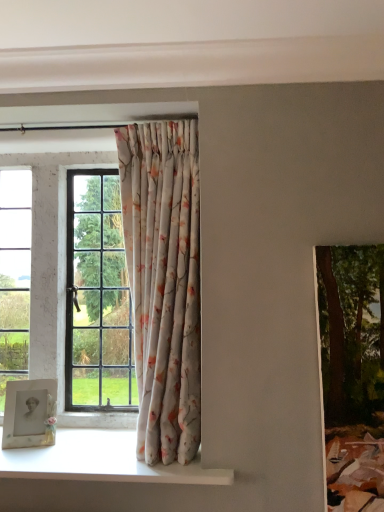
Question: Would you consider matte white picture frame at lower left to be distant from white glossy window sill at lower left?

Choices:
 (A) yes
 (B) no

Answer: (B)

Question: From the image's perspective, does matte white picture frame at lower left appear lower than white glossy window sill at lower left?

Choices:
 (A) no
 (B) yes

Answer: (A)

Question: Considering the relative positions of matte white picture frame at lower left and white glossy window sill at lower left in the image provided, is matte white picture frame at lower left to the left of white glossy window sill at lower left from the viewer's perspective?

Choices:
 (A) no
 (B) yes

Answer: (B)

Question: Can you confirm if matte white picture frame at lower left is shorter than white glossy window sill at lower left?

Choices:
 (A) yes
 (B) no

Answer: (B)

Question: Does matte white picture frame at lower left appear on the right side of white glossy window sill at lower left?

Choices:
 (A) no
 (B) yes

Answer: (A)

Question: Is green textured painting at right wider or thinner than floral fabric curtain at center?

Choices:
 (A) thin
 (B) wide

Answer: (A)

Question: From the image's perspective, is green textured painting at right located above or below floral fabric curtain at center?

Choices:
 (A) above
 (B) below

Answer: (B)

Question: Does point (337, 402) appear closer or farther from the camera than point (150, 230)?

Choices:
 (A) closer
 (B) farther

Answer: (A)

Question: Choose the correct answer: Is green textured painting at right inside floral fabric curtain at center or outside it?

Choices:
 (A) outside
 (B) inside

Answer: (A)

Question: Looking at their shapes, would you say white glossy window sill at lower left is wider or thinner than floral fabric curtain at center?

Choices:
 (A) thin
 (B) wide

Answer: (B)

Question: From the image's perspective, is white glossy window sill at lower left above or below floral fabric curtain at center?

Choices:
 (A) below
 (B) above

Answer: (A)

Question: Is white glossy window sill at lower left in front of or behind floral fabric curtain at center in the image?

Choices:
 (A) behind
 (B) front

Answer: (B)

Question: Considering the positions of white glossy window sill at lower left and floral fabric curtain at center in the image, is white glossy window sill at lower left bigger or smaller than floral fabric curtain at center?

Choices:
 (A) small
 (B) big

Answer: (A)

Question: Would you say white glossy window sill at lower left is inside or outside green textured painting at right?

Choices:
 (A) inside
 (B) outside

Answer: (B)

Question: Considering the positions of point (8, 475) and point (327, 266), is point (8, 475) closer or farther from the camera than point (327, 266)?

Choices:
 (A) closer
 (B) farther

Answer: (B)